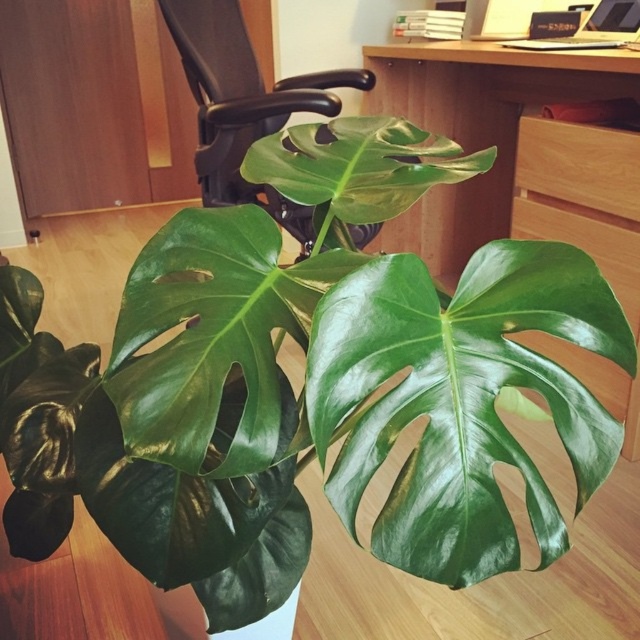
Question: Is wooden at center positioned before wooden drawer at right?

Choices:
 (A) yes
 (B) no

Answer: (A)

Question: Which object is the closest to the black leather swivel chair at center?

Choices:
 (A) wooden drawer at right
 (B) wooden at center
 (C) green glossy leaf at center

Answer: (B)

Question: Is black leather swivel chair at center smaller than wooden drawer at right?

Choices:
 (A) yes
 (B) no

Answer: (B)

Question: Can you confirm if wooden at center is positioned to the right of black leather swivel chair at center?

Choices:
 (A) yes
 (B) no

Answer: (A)

Question: Which of the following is the farthest from the observer?

Choices:
 (A) (365, 472)
 (B) (536, 150)
 (C) (492, 99)
 (D) (168, 20)

Answer: (C)

Question: Which of the following is the farthest from the observer?

Choices:
 (A) (572, 160)
 (B) (278, 214)

Answer: (B)